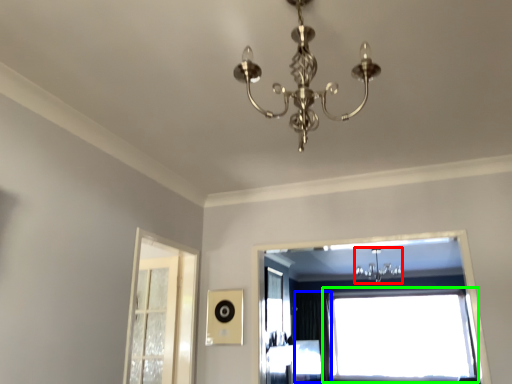
Question: Based on their relative distances, which object is nearer to light fixture (highlighted by a red box)? Choose from curtain (highlighted by a blue box) and window (highlighted by a green box).

Choices:
 (A) curtain
 (B) window

Answer: (B)